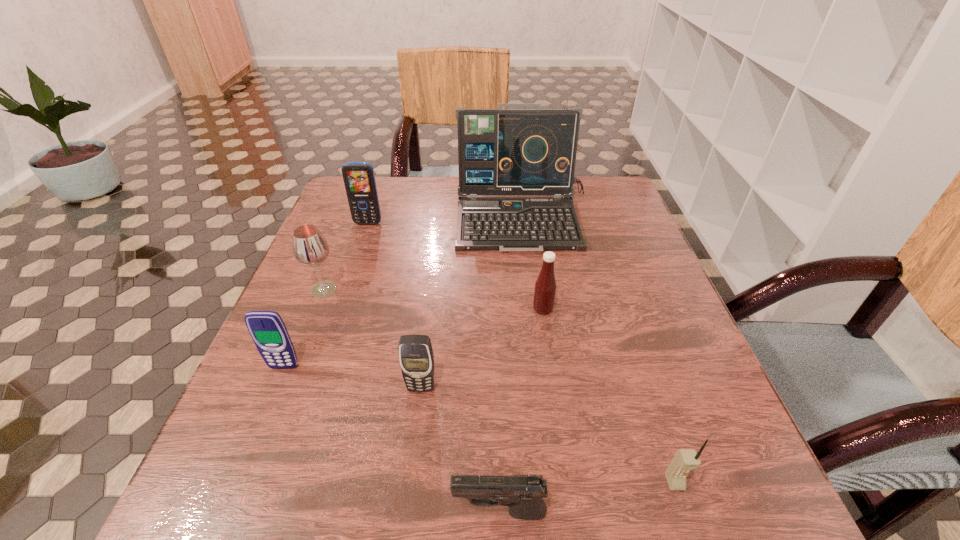
Find the location of a particular element. laptop computer positioned at the far edge is located at coordinates (501, 151).

Locate an element on the screen. cellular telephone present at the far edge is located at coordinates (359, 179).

Locate an element on the screen. The width and height of the screenshot is (960, 540). cellular telephone located at the near edge is located at coordinates (685, 460).

Locate an element on the screen. pistol that is at the near edge is located at coordinates (523, 494).

You are a GUI agent. You are given a task and a screenshot of the screen. Output one action in this format:
    pyautogui.click(x=<x>, y=<y>)
    Task: Click on the wineglass positioned at the left edge
    
    Given the screenshot: What is the action you would take?
    pyautogui.click(x=310, y=248)

At what (x,y) coordinates should I click in order to perform the action: click on laptop computer present at the right edge. Please return your answer as a coordinate pair (x, y). This screenshot has height=540, width=960. Looking at the image, I should click on [501, 151].

Identify the location of cellular telephone located in the right edge section of the desktop. This screenshot has width=960, height=540. (685, 460).

Where is `object that is positioned at the far left corner`? Image resolution: width=960 pixels, height=540 pixels. object that is positioned at the far left corner is located at coordinates (359, 179).

The height and width of the screenshot is (540, 960). Identify the location of object positioned at the far right corner. (501, 151).

Find the location of `object that is at the near right corner`. object that is at the near right corner is located at coordinates (685, 460).